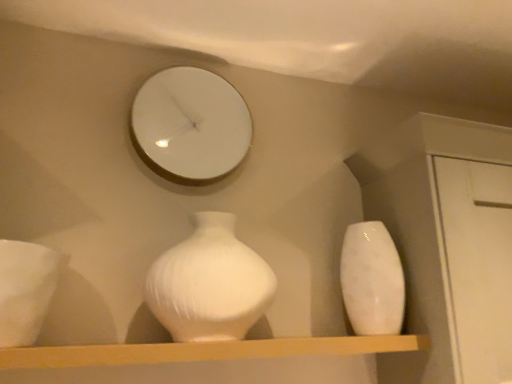
Question: From the image's perspective, is white glossy mirror at upper center above or below smooth wooden shelf at center?

Choices:
 (A) below
 (B) above

Answer: (B)

Question: Is point (139, 96) closer or farther from the camera than point (125, 359)?

Choices:
 (A) farther
 (B) closer

Answer: (A)

Question: Estimate the real-world distances between objects in this image. Which object is closer to the smooth wooden shelf at center?

Choices:
 (A) white glossy mirror at upper center
 (B) white glossy vase at right, the second vase viewed from the left
 (C) white glossy vase at left
 (D) white glossy vase at center, arranged as the 1th vase when viewed from the left

Answer: (D)

Question: Which object is the closest to the smooth wooden shelf at center?

Choices:
 (A) white glossy vase at center, arranged as the 1th vase when viewed from the left
 (B) white glossy mirror at upper center
 (C) white glossy vase at right, the 1th vase positioned from the right
 (D) white glossy vase at left

Answer: (A)